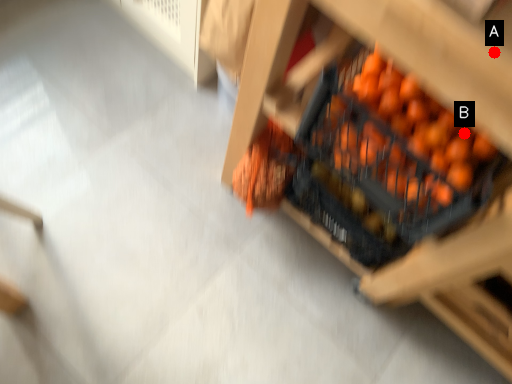
Question: Two points are circled on the image, labeled by A and B beside each circle. Which point is closer to the camera?

Choices:
 (A) A is closer
 (B) B is closer

Answer: (A)